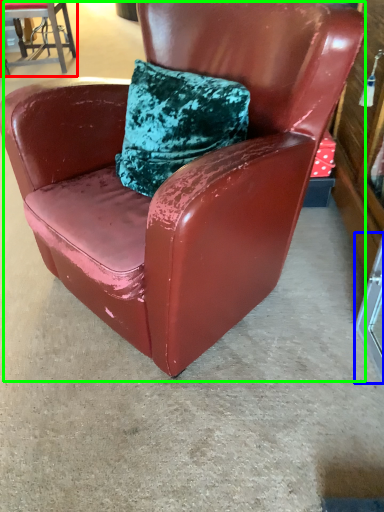
Question: Based on their relative distances, which object is farther from chair (highlighted by a red box)? Choose from glass door (highlighted by a blue box) and chair (highlighted by a green box).

Choices:
 (A) glass door
 (B) chair

Answer: (A)